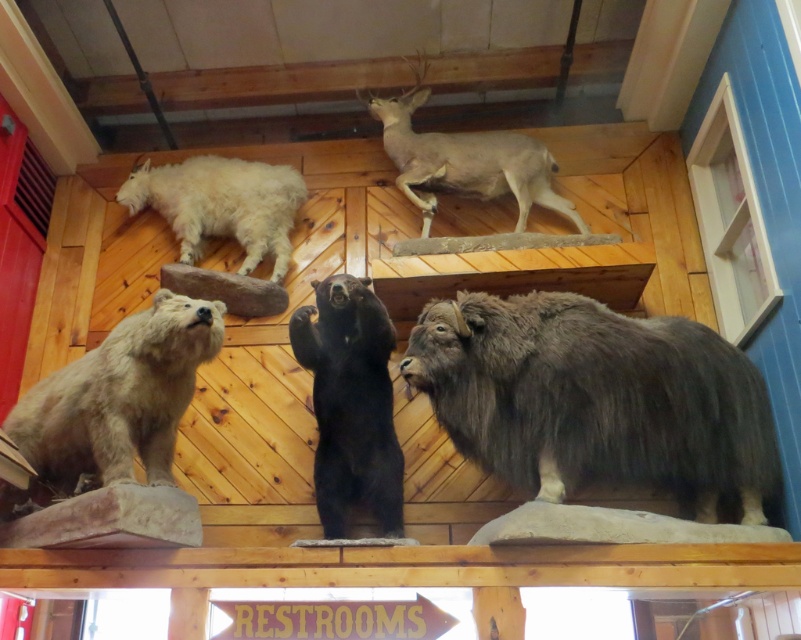
Question: Which point is farther from the camera taking this photo?

Choices:
 (A) (286, 211)
 (B) (570, 337)
 (C) (337, 515)

Answer: (A)

Question: Which point is closer to the camera?

Choices:
 (A) (512, 364)
 (B) (119, 362)
 (C) (179, 182)

Answer: (A)

Question: Is brown fuzzy yak at lower right positioned at the back of light brown fur deer at upper center?

Choices:
 (A) yes
 (B) no

Answer: (B)

Question: Is light brown fur bear at lower left bigger than light brown fur deer at upper center?

Choices:
 (A) no
 (B) yes

Answer: (A)

Question: Can you confirm if light brown fur bear at lower left is positioned to the right of black furry bear at center?

Choices:
 (A) no
 (B) yes

Answer: (A)

Question: Which object appears farthest from the camera in this image?

Choices:
 (A) brown fuzzy yak at lower right
 (B) light brown fur deer at upper center

Answer: (B)